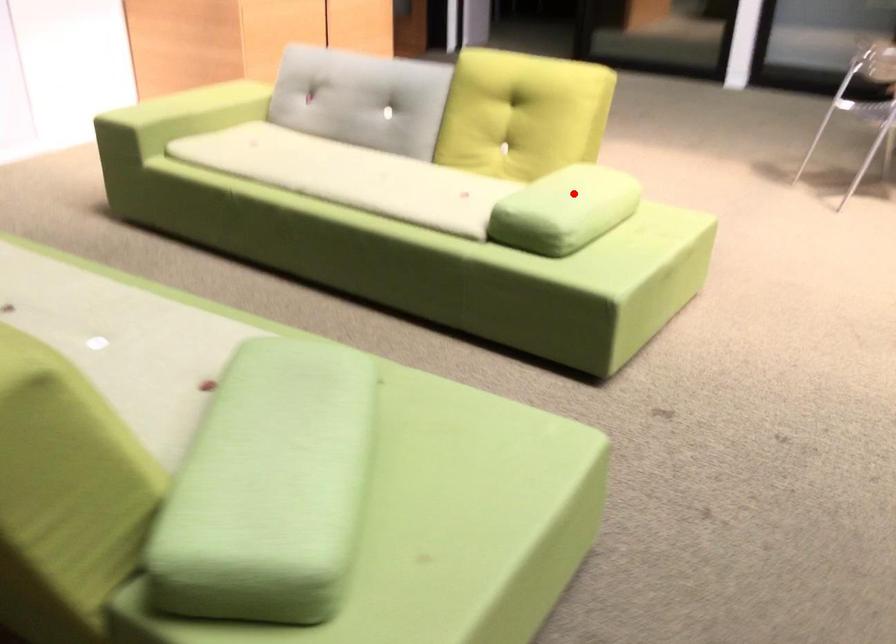
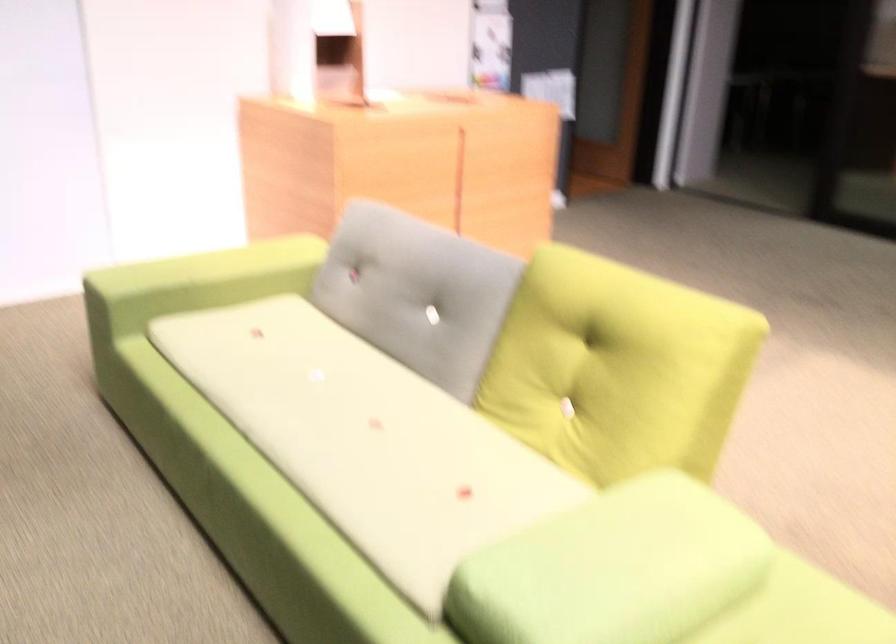
Question: I am providing you with two images of the same scene from different viewpoints. In image1, a red point is highlighted. Considering the same 3D point in image2, which of the following is correct?

Choices:
 (A) It is closer
 (B) It is farther

Answer: (A)